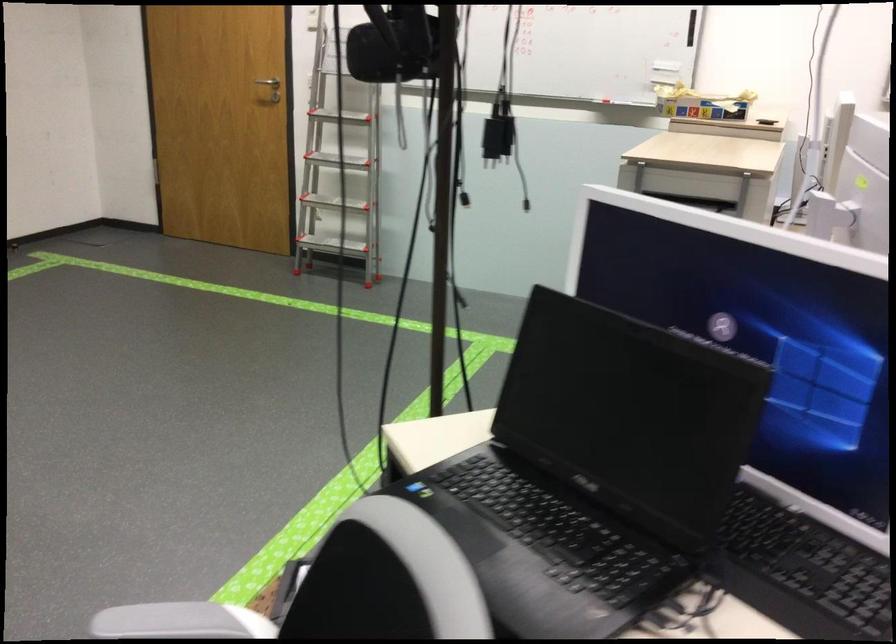
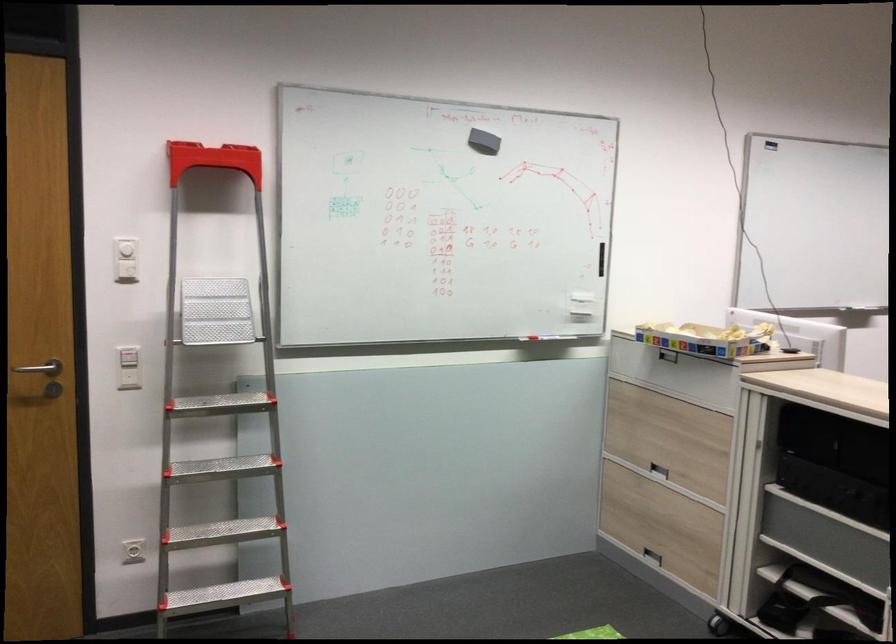
Where in the second image is the point corresponding to the point at 622,102 from the first image?

(539, 337)